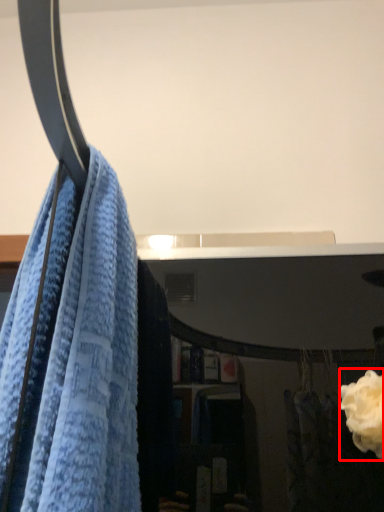
Question: From the image's perspective, what is the correct spatial positioning of rose (annotated by the red box) in reference to towel?

Choices:
 (A) below
 (B) above

Answer: (A)